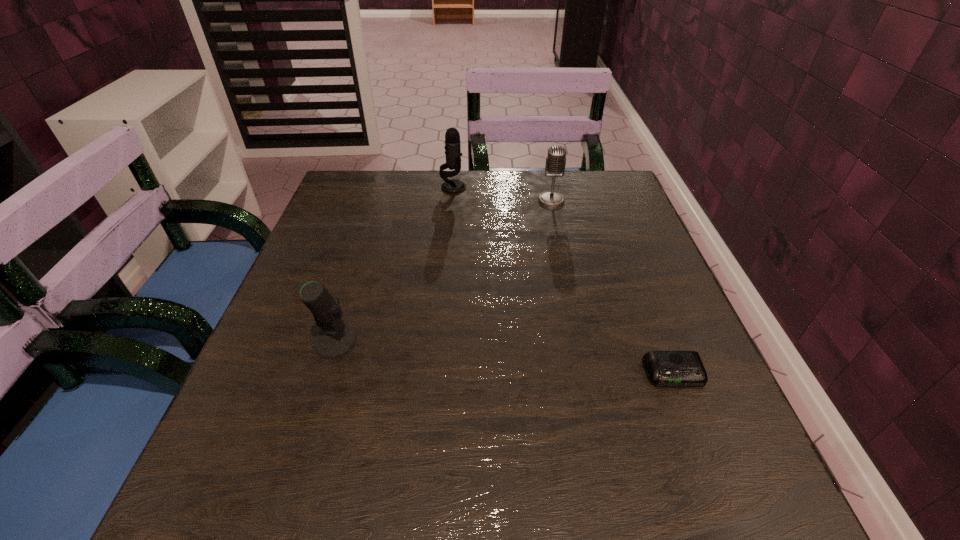
Image resolution: width=960 pixels, height=540 pixels. Identify the location of the second microphone from right to left. [453, 153].

This screenshot has width=960, height=540. In order to click on the second object from right to left in this screenshot , I will do `click(555, 164)`.

Find the location of `the third farthest object`. the third farthest object is located at coordinates (333, 341).

Identify the location of the leftmost object. This screenshot has width=960, height=540. (333, 341).

Locate an element on the screen. The width and height of the screenshot is (960, 540). the shortest object is located at coordinates (664, 368).

You are a GUI agent. You are given a task and a screenshot of the screen. Output one action in this format:
    pyautogui.click(x=<x>, y=<y>)
    Task: Click on the alarm clock
    The height and width of the screenshot is (540, 960).
    Given the screenshot: What is the action you would take?
    pyautogui.click(x=664, y=368)

Find the location of a particular element. free space located 0.160m on the right of the second microphone from left to right is located at coordinates (524, 187).

Identify the location of vacant area located 0.180m on the front of the third object from left to right. This screenshot has width=960, height=540. (563, 251).

This screenshot has width=960, height=540. Find the location of `free space located 0.070m on the back of the nearest microphone`. free space located 0.070m on the back of the nearest microphone is located at coordinates (348, 300).

This screenshot has width=960, height=540. Identify the location of free space located on the display of the alarm clock. (703, 445).